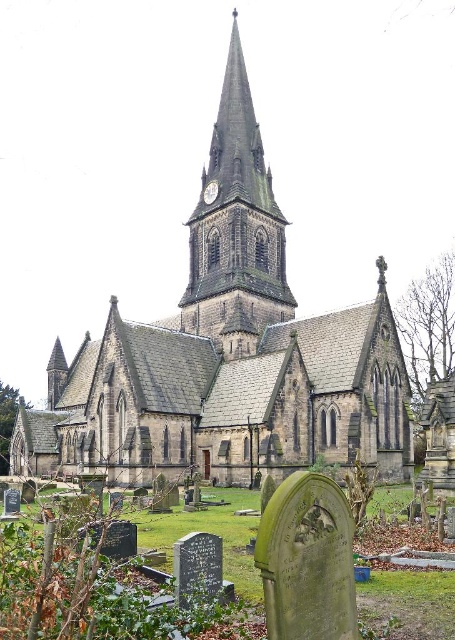
Question: Which point appears closest to the camera in this image?

Choices:
 (A) (232, 291)
 (B) (213, 195)
 (C) (212, 237)

Answer: (A)

Question: Which is nearer to the dark gray stone church at center?

Choices:
 (A) metallic clock at center
 (B) dark gray stone clock tower at center

Answer: (B)

Question: Which point is closer to the camera?

Choices:
 (A) dark gray stone clock tower at center
 (B) dark gray stone church at center
 (C) metallic clock at center

Answer: (B)

Question: Is dark gray stone clock tower at center below metallic clock at center?

Choices:
 (A) yes
 (B) no

Answer: (B)

Question: Is dark gray stone church at center below dark gray stone clock tower at center?

Choices:
 (A) yes
 (B) no

Answer: (A)

Question: Can you confirm if dark gray stone clock tower at center is positioned above metallic clock at center?

Choices:
 (A) yes
 (B) no

Answer: (A)